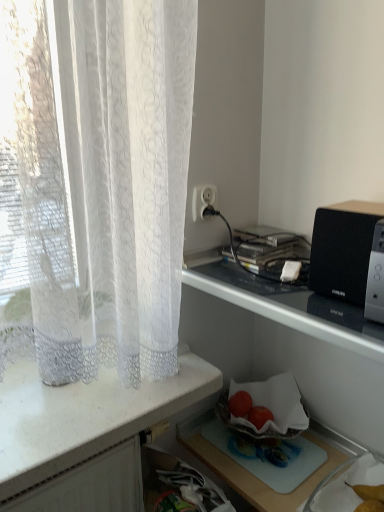
Question: Would you say black plastic speaker at upper right is to the left or to the right of white lace curtain at left in the picture?

Choices:
 (A) left
 (B) right

Answer: (B)

Question: Is black plastic speaker at upper right bigger or smaller than white lace curtain at left?

Choices:
 (A) big
 (B) small

Answer: (B)

Question: Which of these objects is positioned farthest from the yellow matte pear at lower right?

Choices:
 (A) red matte tomato at lower center, which is the 1th fruit from left to right
 (B) white plastic socket at upper center
 (C) black plastic speaker at upper right
 (D) metallic silver microwave at upper right
 (E) translucent glass bowl at lower center

Answer: (B)

Question: Estimate the real-world distances between objects in this image. Which object is farther from the white lace curtain at left?

Choices:
 (A) translucent glass bowl at lower center
 (B) black plastic speaker at upper right
 (C) smooth red strawberries at center, which is the second fruit from left to right
 (D) white plastic socket at upper center
 (E) yellow matte pear at lower right

Answer: (E)